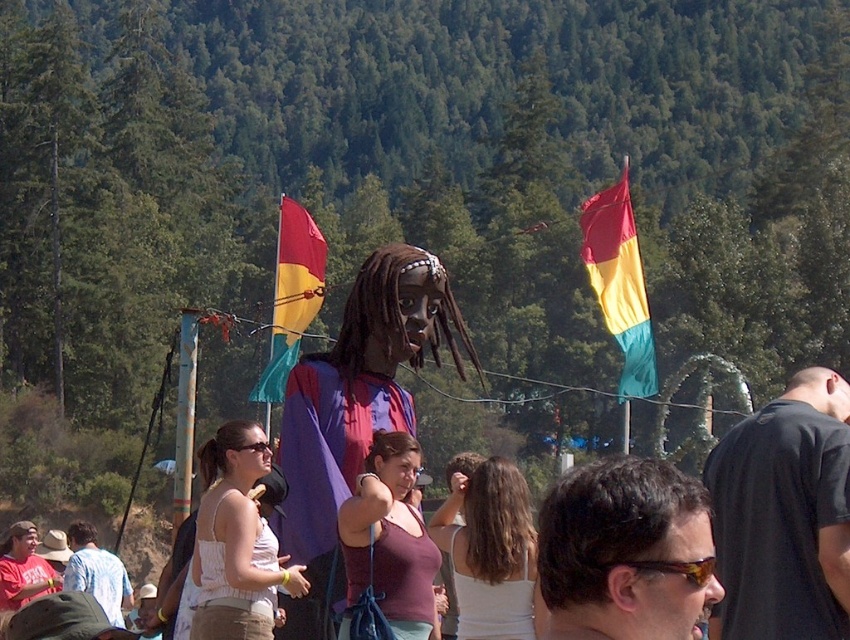
Question: Is purple fabric costume at center closer to the viewer compared to red fabric flag at center?

Choices:
 (A) no
 (B) yes

Answer: (B)

Question: Can you confirm if white fabric tank top at center is thinner than matte white t-shirt at lower left?

Choices:
 (A) yes
 (B) no

Answer: (A)

Question: Estimate the real-world distances between objects in this image. Which object is farther from the black matte shirt at center?

Choices:
 (A) red/yellow/green fabric flag at upper right
 (B) red fabric flag at center
 (C) matte purple dress at center
 (D) white fabric tank top at center

Answer: (A)

Question: Which of the following is the farthest from the observer?

Choices:
 (A) (647, 358)
 (B) (20, 548)
 (C) (201, 552)
 (D) (428, 612)

Answer: (A)

Question: Which of the following is the closest to the observer?

Choices:
 (A) matte purple dress at center
 (B) red/yellow/green fabric flag at upper right
 (C) matte white t-shirt at lower left

Answer: (A)

Question: Does red/yellow/green fabric flag at upper right have a larger size compared to white lace tank top at center?

Choices:
 (A) no
 (B) yes

Answer: (B)